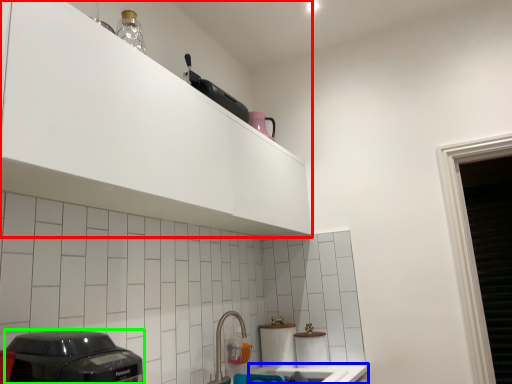
Question: Which object is positioned closest to cabinetry (highlighted by a red box)? Select from counter top (highlighted by a blue box) and home appliance (highlighted by a green box).

Choices:
 (A) counter top
 (B) home appliance

Answer: (B)